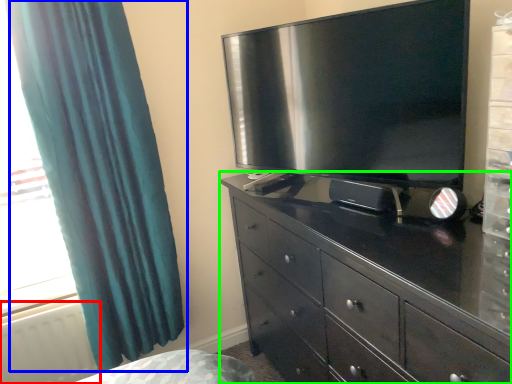
Question: Which object is the farthest from radiator (highlighted by a red box)? Choose among these: curtain (highlighted by a blue box) or chest of drawers (highlighted by a green box).

Choices:
 (A) curtain
 (B) chest of drawers

Answer: (B)